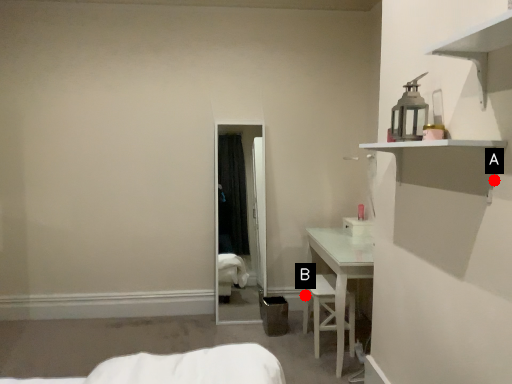
Question: Two points are circled on the image, labeled by A and B beside each circle. Which point is closer to the camera?

Choices:
 (A) A is closer
 (B) B is closer

Answer: (A)